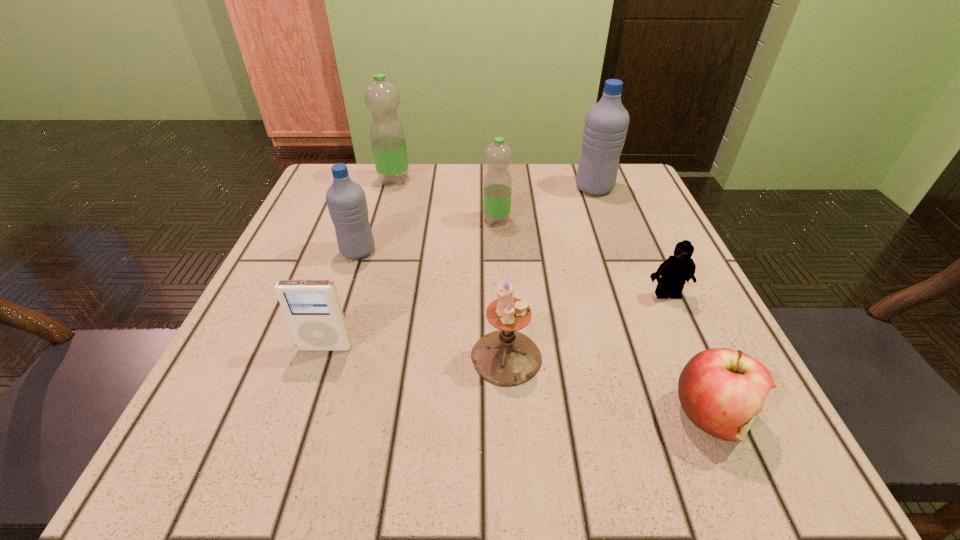
Where is `Lego`? This screenshot has height=540, width=960. Lego is located at coordinates (678, 268).

The width and height of the screenshot is (960, 540). Identify the location of black Lego. (678, 268).

This screenshot has height=540, width=960. Identify the location of apple. (722, 391).

This screenshot has height=540, width=960. In order to click on vacant area situated on the left of the farther blue water bottle in this screenshot , I will do `click(553, 188)`.

Identify the location of vacant area situated on the left of the bigger green water bottle. (324, 180).

This screenshot has height=540, width=960. Find the location of `vacant region located 0.100m on the right of the second nearest water bottle`. vacant region located 0.100m on the right of the second nearest water bottle is located at coordinates (558, 220).

In order to click on vacant region located on the front of the nearer blue water bottle in this screenshot , I will do `click(345, 292)`.

Image resolution: width=960 pixels, height=540 pixels. I want to click on blank space located 0.120m on the front of the purple candle holder, so click(513, 471).

Where is `free space located on the front-facing side of the iPod`? free space located on the front-facing side of the iPod is located at coordinates (300, 425).

Locate an element on the screen. Image resolution: width=960 pixels, height=540 pixels. free space located on the face of the Lego is located at coordinates (680, 322).